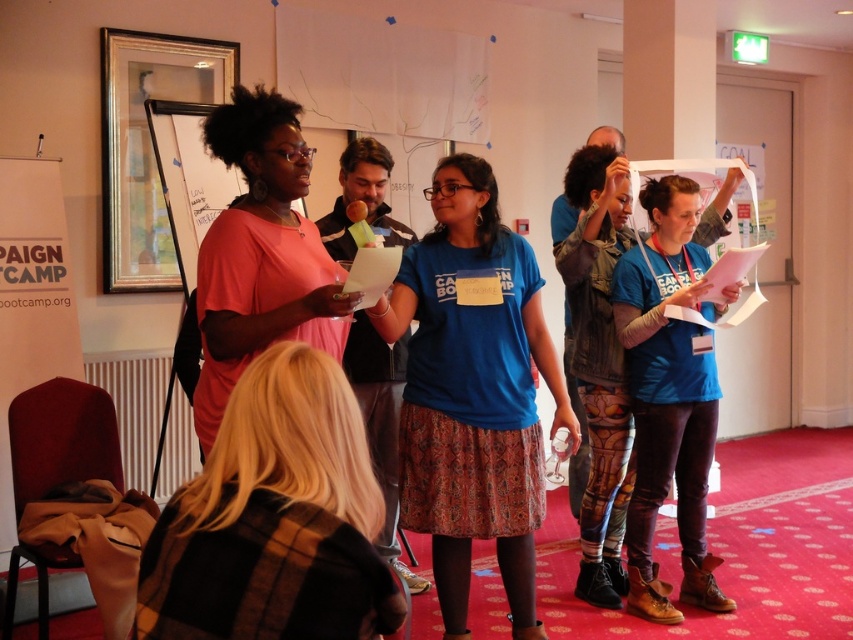
Is the position of plaid woolen sweater at center more distant than that of blue printed leggings at center?

No, it is not.

Can you confirm if plaid woolen sweater at center is bigger than blue printed leggings at center?

Incorrect, plaid woolen sweater at center is not larger than blue printed leggings at center.

Where is `plaid woolen sweater at center`? The width and height of the screenshot is (853, 640). plaid woolen sweater at center is located at coordinates (274, 518).

Image resolution: width=853 pixels, height=640 pixels. Find the location of `plaid woolen sweater at center`. plaid woolen sweater at center is located at coordinates (274, 518).

Who is more distant from viewer, (x=276, y=397) or (x=67, y=339)?

Point (x=67, y=339)

Can you confirm if plaid woolen sweater at center is thinner than white paper at left?

In fact, plaid woolen sweater at center might be wider than white paper at left.

At what (x,y) coordinates should I click in order to perform the action: click on plaid woolen sweater at center. Please return your answer as a coordinate pair (x, y). Image resolution: width=853 pixels, height=640 pixels. Looking at the image, I should click on click(x=274, y=518).

Looking at this image, does matte pink dress at center have a larger size compared to blue printed leggings at center?

Incorrect, matte pink dress at center is not larger than blue printed leggings at center.

Which is behind, point (223, 113) or point (613, 493)?

The point (613, 493) is behind.

Where is `matte pink dress at center`? Image resolution: width=853 pixels, height=640 pixels. matte pink dress at center is located at coordinates (260, 253).